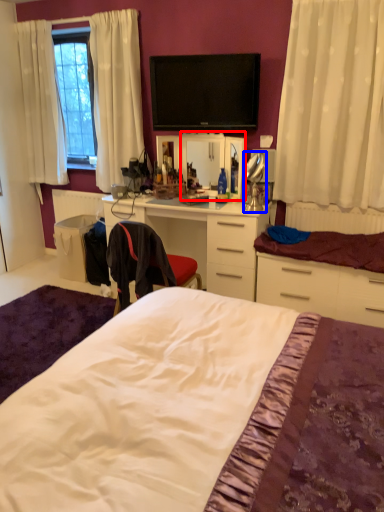
Question: Which of the following is the closest to the observer, mirror (highlighted by a red box) or table lamp (highlighted by a blue box)?

Choices:
 (A) mirror
 (B) table lamp

Answer: (B)